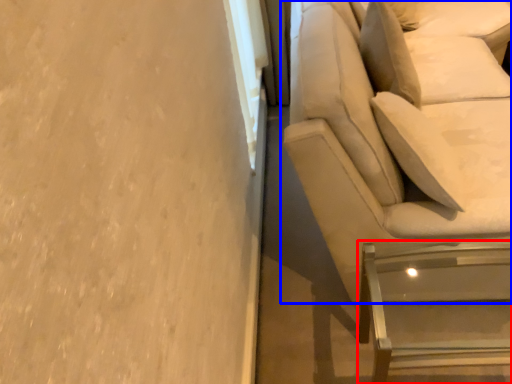
Question: Which point is closer to the camera, furniture (highlighted by a red box) or studio couch (highlighted by a blue box)?

Choices:
 (A) furniture
 (B) studio couch

Answer: (B)